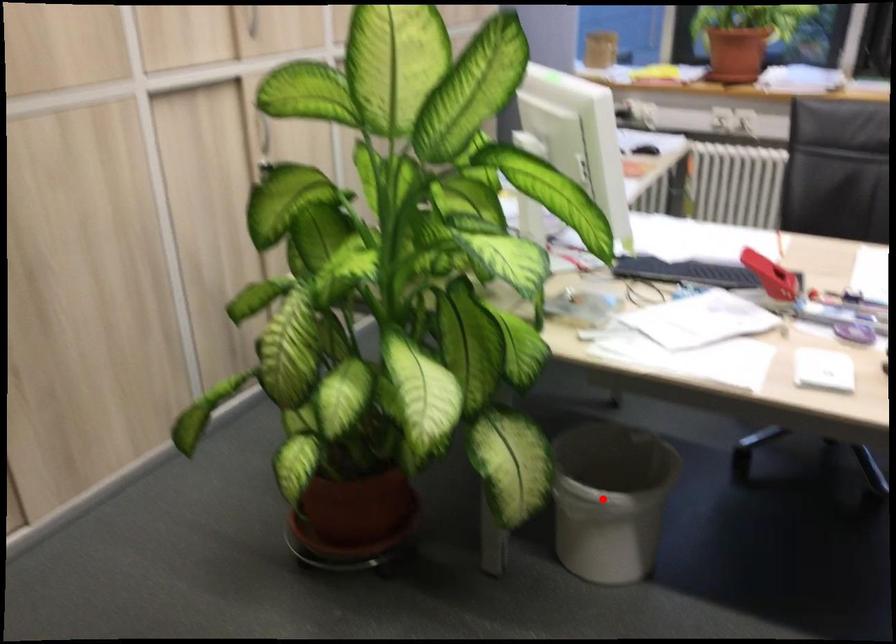
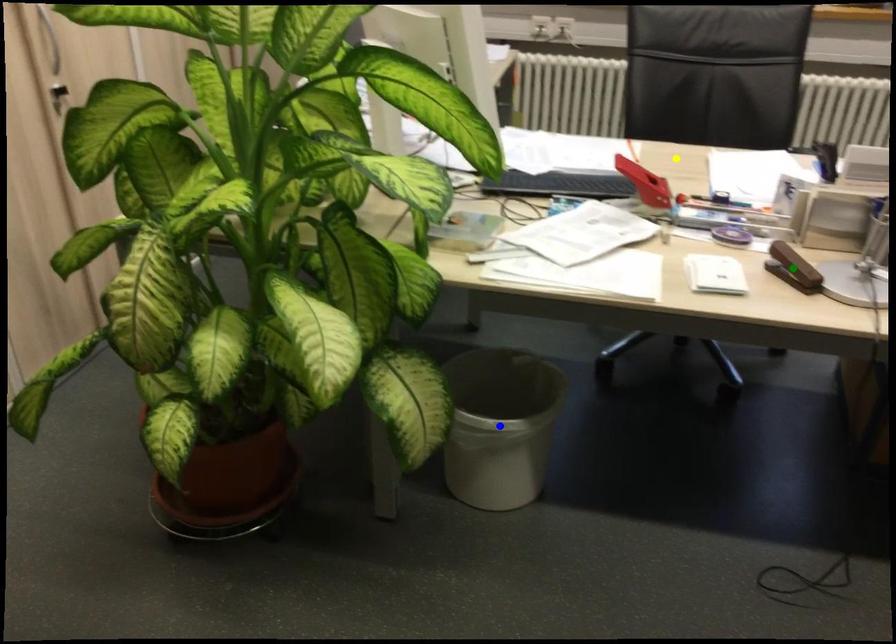
Question: I am providing you with two images of the same scene from different viewpoints. A red point is marked on the first image. You are given multiple points on the second image. In image 2, which mark is for the same physical point as the one in image 1?

Choices:
 (A) blue point
 (B) green point
 (C) yellow point

Answer: (A)